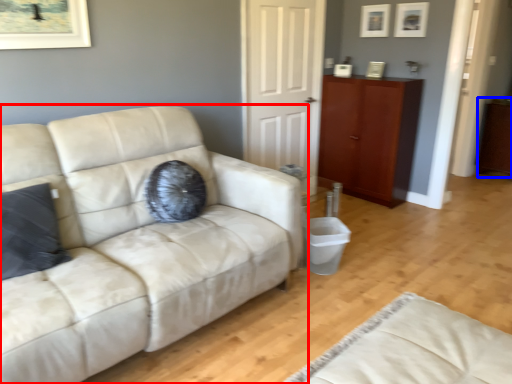
Question: Among these objects, which one is nearest to the camera, studio couch (highlighted by a red box) or dresser (highlighted by a blue box)?

Choices:
 (A) studio couch
 (B) dresser

Answer: (A)